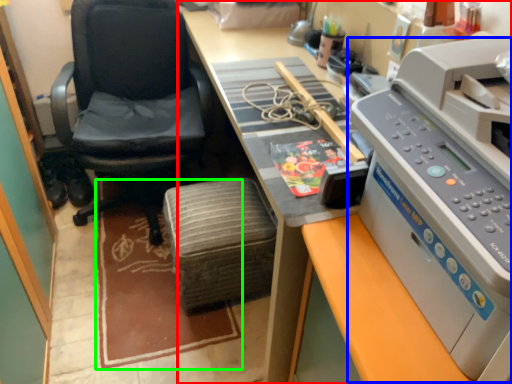
Question: Which object is the farthest from desk (highlighted by a red box)? Choose among these: printer (highlighted by a blue box) or mat (highlighted by a green box).

Choices:
 (A) printer
 (B) mat

Answer: (B)